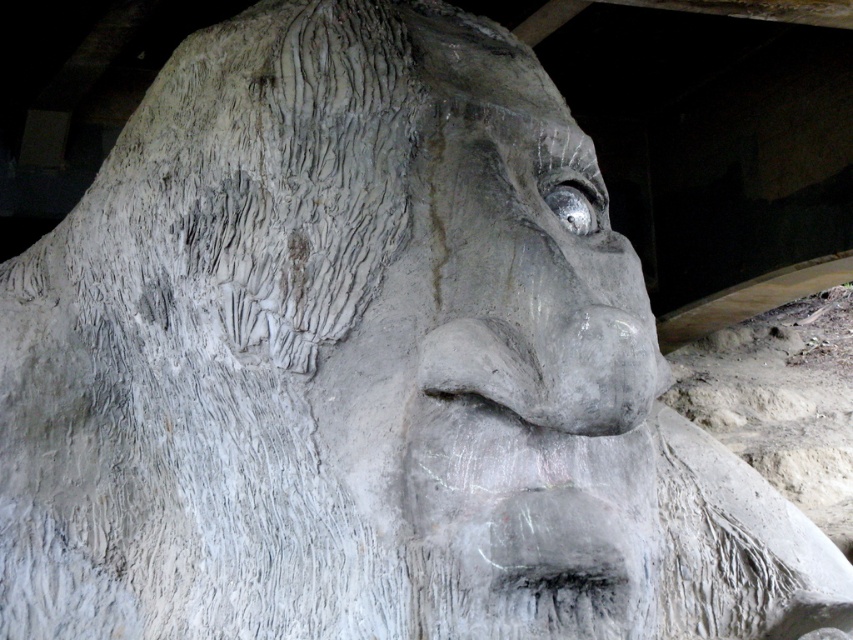
Question: Does gray stone face at center lie in front of metallic reflective eye at upper center?

Choices:
 (A) yes
 (B) no

Answer: (A)

Question: Does gray stone face at center appear on the right side of metallic reflective eye at upper center?

Choices:
 (A) yes
 (B) no

Answer: (B)

Question: Which point is closer to the camera?

Choices:
 (A) gray stone face at center
 (B) gray textured nose at center
 (C) metallic reflective eye at upper center

Answer: (A)

Question: Considering the real-world distances, which object is closest to the metallic reflective eye at upper center?

Choices:
 (A) gray stone face at center
 (B) gray textured nose at center

Answer: (A)

Question: Can you confirm if gray textured nose at center is bigger than metallic reflective eye at upper center?

Choices:
 (A) no
 (B) yes

Answer: (B)

Question: Which point is closer to the camera?

Choices:
 (A) gray stone face at center
 (B) metallic reflective eye at upper center

Answer: (A)